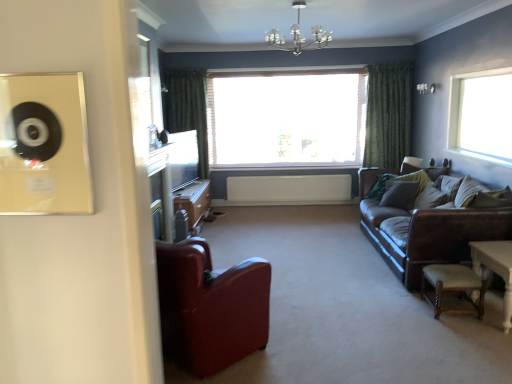
Question: Is white wooden table at lower right inside green velvet curtain at left, acting as the second curtain starting from the right?

Choices:
 (A) no
 (B) yes

Answer: (A)

Question: Is green velvet curtain at left, which is counted as the 1th curtain, starting from the left, far from white wooden table at lower right?

Choices:
 (A) no
 (B) yes

Answer: (B)

Question: Is green velvet curtain at left, which is counted as the 1th curtain, starting from the left, smaller than white wooden table at lower right?

Choices:
 (A) yes
 (B) no

Answer: (B)

Question: Is green velvet curtain at left, acting as the second curtain starting from the right, closer to the viewer compared to white wooden table at lower right?

Choices:
 (A) no
 (B) yes

Answer: (A)

Question: Could you tell me if green velvet curtain at left, which is counted as the 1th curtain, starting from the left, is facing white wooden table at lower right?

Choices:
 (A) no
 (B) yes

Answer: (A)

Question: Is green velvet curtain at left, acting as the second curtain starting from the right, wider than white wooden table at lower right?

Choices:
 (A) yes
 (B) no

Answer: (B)

Question: Can you confirm if transparent glass window at upper right, the 1th window viewed from the right, is thinner than green velvet curtain at left, acting as the second curtain starting from the right?

Choices:
 (A) no
 (B) yes

Answer: (B)

Question: Is green velvet curtain at left, which is counted as the 1th curtain, starting from the left, a part of transparent glass window at upper right, the 1th window viewed from the right?

Choices:
 (A) yes
 (B) no

Answer: (B)

Question: Is transparent glass window at upper right, which appears as the first window when viewed from the front, positioned before green velvet curtain at left, acting as the second curtain starting from the right?

Choices:
 (A) yes
 (B) no

Answer: (A)

Question: Is transparent glass window at upper right, the 2th window positioned from the back, placed right next to green velvet curtain at left, which is counted as the 1th curtain, starting from the left?

Choices:
 (A) yes
 (B) no

Answer: (B)

Question: From the image's perspective, does transparent glass window at upper right, the 2th window positioned from the back, appear lower than green velvet curtain at left, acting as the second curtain starting from the right?

Choices:
 (A) yes
 (B) no

Answer: (A)

Question: Is transparent glass window at upper right, arranged as the second window when viewed from the left, bigger than green velvet curtain at left, which is counted as the 1th curtain, starting from the left?

Choices:
 (A) yes
 (B) no

Answer: (B)

Question: From a real-world perspective, does brown leather couch at right stand above white wooden table at lower right?

Choices:
 (A) yes
 (B) no

Answer: (A)